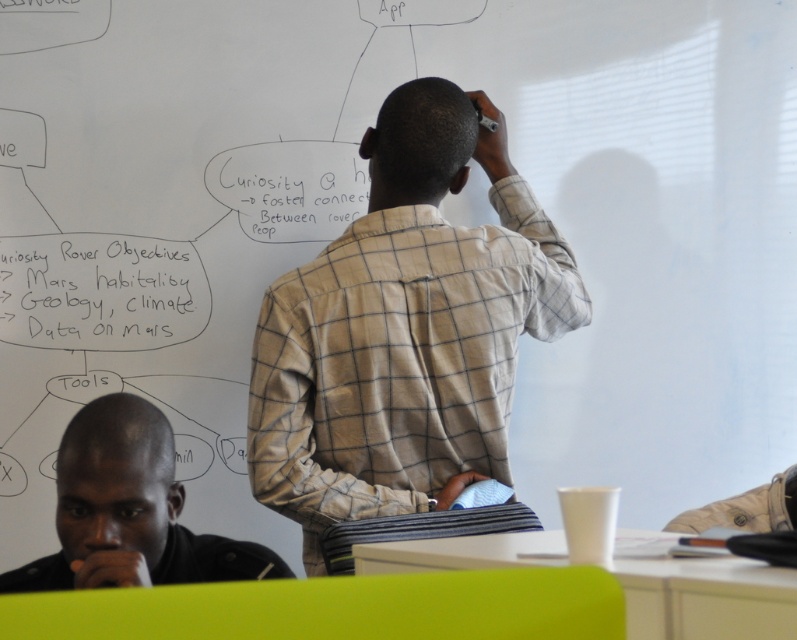
From the picture: You are an observer in the classroom. You see the light beige checkered shirt at center and the black leather jacket at lower left. Which clothing item takes up more space in the image?

The light beige checkered shirt at center is bigger than the black leather jacket at lower left, so it takes up more space in the image.

You are a student in the classroom and need to reach the white paperboard at upper center to write something. There is a black leather jacket at lower left in the way. Can you walk around it easily?

The black leather jacket at lower left is much taller than the white paperboard at upper center, so it might block your path. You may need to move it aside or find another route to reach the white paperboard at upper center.